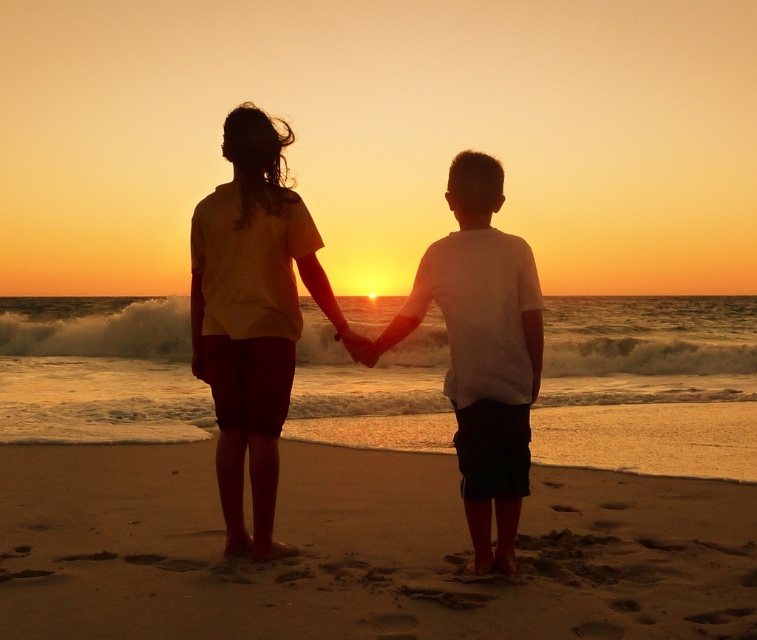
Between silhouette clothing at center and white matte shirt at center, which one is positioned lower?

white matte shirt at center is lower down.

Locate an element on the screen. This screenshot has height=640, width=757. silhouette clothing at center is located at coordinates pyautogui.click(x=256, y=320).

Describe the element at coordinates (256, 320) in the screenshot. I see `silhouette clothing at center` at that location.

At what (x,y) coordinates should I click in order to perform the action: click on silhouette clothing at center. Please return your answer as a coordinate pair (x, y). The width and height of the screenshot is (757, 640). Looking at the image, I should click on (256, 320).

Is point (209, 253) in front of point (527, 296)?

No, it is not.

Is matte yellow shirt at center closer to camera compared to white matte shirt at center?

No, matte yellow shirt at center is further to the viewer.

In the scene shown: Who is more forward, (220,236) or (483,275)?

Positioned in front is point (483,275).

You are a GUI agent. You are given a task and a screenshot of the screen. Output one action in this format:
    pyautogui.click(x=<x>, y=<y>)
    Task: Click on the matte yellow shirt at center
    The image size is (757, 640).
    Given the screenshot: What is the action you would take?
    pyautogui.click(x=251, y=316)

Is silhouette clothing at center positioned in front of matte yellow shirt at center?

Yes, silhouette clothing at center is in front of matte yellow shirt at center.

Identify the location of silhouette clothing at center. (256, 320).

Is point (391, 332) positioned behind point (279, 330)?

No, (391, 332) is in front of (279, 330).

Image resolution: width=757 pixels, height=640 pixels. Find the location of `silhouette clothing at center`. silhouette clothing at center is located at coordinates [256, 320].